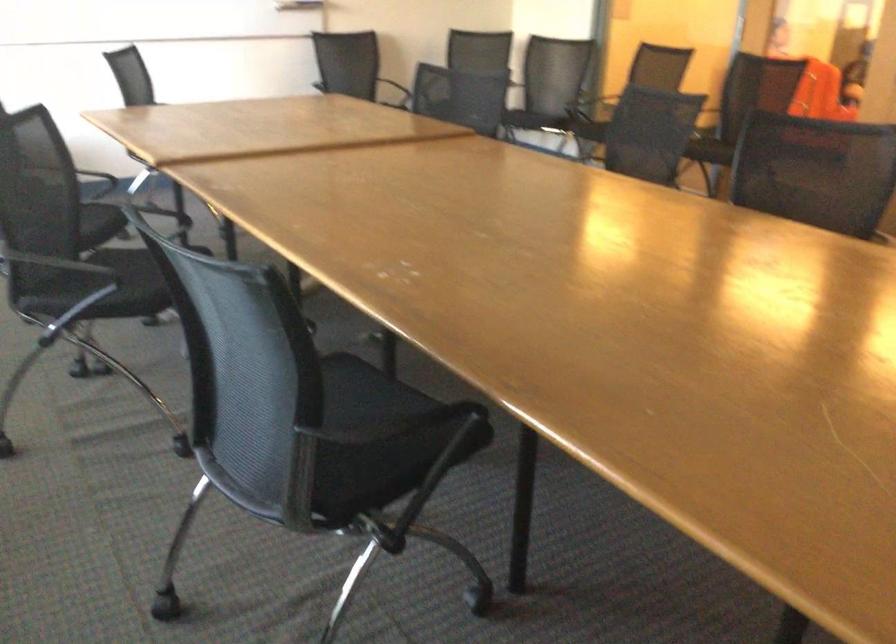
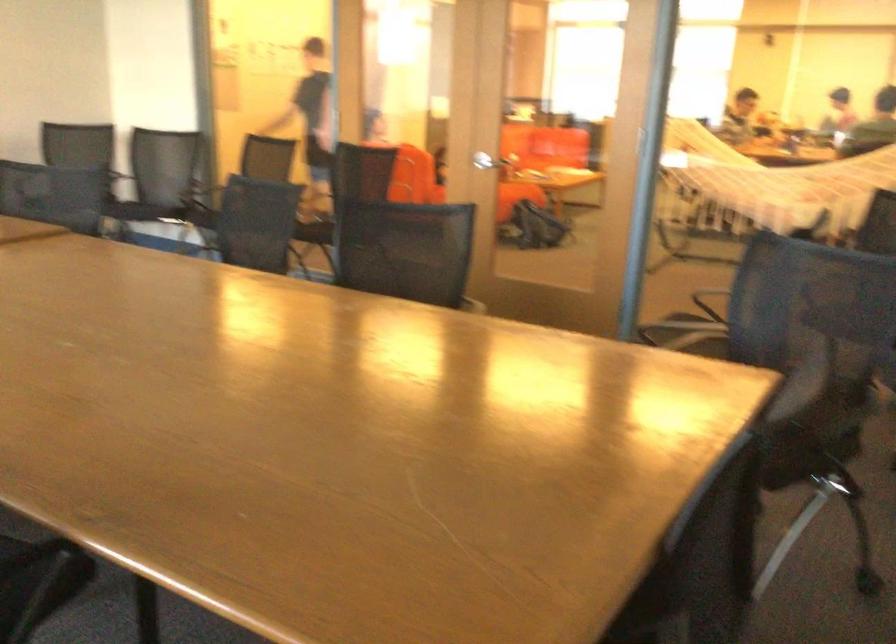
Question: The images are taken continuously from a first-person perspective. In which direction is your viewpoint rotating?

Choices:
 (A) Left
 (B) Right
 (C) Up
 (D) Down

Answer: (B)